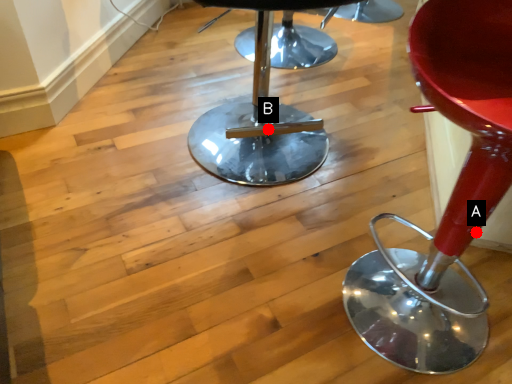
Question: Two points are circled on the image, labeled by A and B beside each circle. Which point appears closest to the camera in this image?

Choices:
 (A) A is closer
 (B) B is closer

Answer: (A)